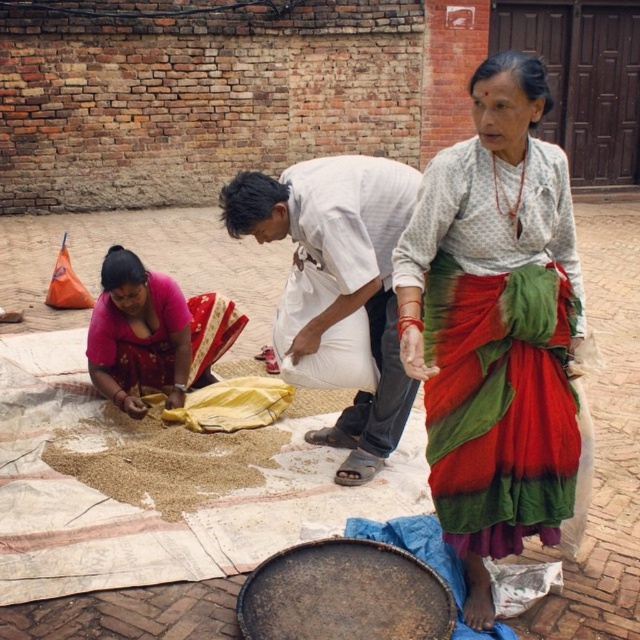
Question: Does multicolored fabric at center have a lesser width compared to matte pink blouse at lower left?

Choices:
 (A) yes
 (B) no

Answer: (A)

Question: Which of the following is the farthest from the observer?

Choices:
 (A) (458, 314)
 (B) (182, 355)

Answer: (B)

Question: Can you confirm if multicolored fabric at center is thinner than matte pink blouse at lower left?

Choices:
 (A) yes
 (B) no

Answer: (A)

Question: Which point is closer to the camera?

Choices:
 (A) matte pink blouse at lower left
 (B) multicolored fabric at center

Answer: (B)

Question: Does multicolored fabric at center have a lesser width compared to matte pink blouse at lower left?

Choices:
 (A) yes
 (B) no

Answer: (A)

Question: Which point appears closest to the camera in this image?

Choices:
 (A) (532, 182)
 (B) (154, 300)

Answer: (A)